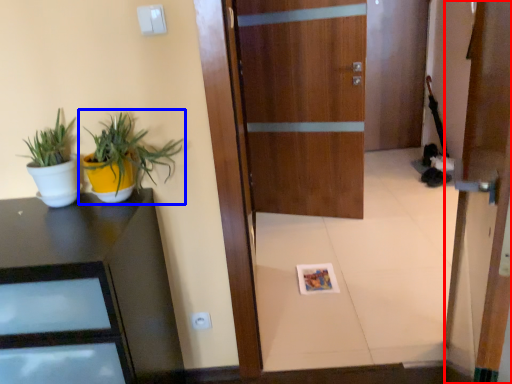
Question: Which point is closer to the camera, door (highlighted by a red box) or houseplant (highlighted by a blue box)?

Choices:
 (A) door
 (B) houseplant

Answer: (A)